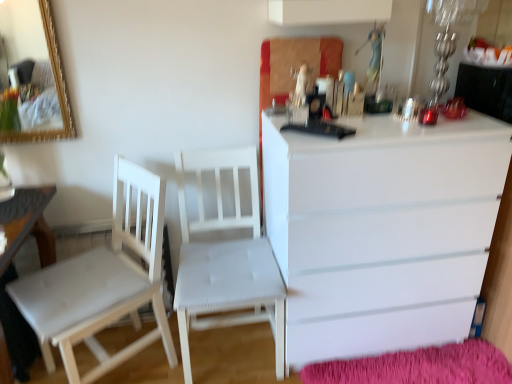
Question: From the image's perspective, is white wood table at lower left on white wood chair at center, which is the 2th chair in right-to-left order?

Choices:
 (A) yes
 (B) no

Answer: (B)

Question: Is white wood table at lower left located outside white wood chair at center, arranged as the first chair when viewed from the left?

Choices:
 (A) no
 (B) yes

Answer: (B)

Question: Are white wood table at lower left and white wood chair at center, arranged as the first chair when viewed from the left, far apart?

Choices:
 (A) yes
 (B) no

Answer: (B)

Question: Is white wood table at lower left oriented towards white wood chair at center, which is the 2th chair in right-to-left order?

Choices:
 (A) no
 (B) yes

Answer: (A)

Question: From the image's perspective, is white wood table at lower left located beneath white wood chair at center, which is the 2th chair in right-to-left order?

Choices:
 (A) no
 (B) yes

Answer: (B)

Question: Considering the positions of white wood chair at center, which is the 2th chair in right-to-left order, and fuzzy pink mat at lower right in the image, is white wood chair at center, which is the 2th chair in right-to-left order, bigger or smaller than fuzzy pink mat at lower right?

Choices:
 (A) small
 (B) big

Answer: (B)

Question: Is white wood chair at center, which is the 2th chair in right-to-left order, in front of or behind fuzzy pink mat at lower right in the image?

Choices:
 (A) behind
 (B) front

Answer: (B)

Question: Is white wood chair at center, arranged as the first chair when viewed from the left, situated inside fuzzy pink mat at lower right or outside?

Choices:
 (A) outside
 (B) inside

Answer: (A)

Question: In terms of height, does white wood chair at center, which is the 2th chair in right-to-left order, look taller or shorter compared to fuzzy pink mat at lower right?

Choices:
 (A) tall
 (B) short

Answer: (A)

Question: From the image's perspective, is white glossy chest of drawers at right above or below white wood chair at center, arranged as the first chair when viewed from the left?

Choices:
 (A) above
 (B) below

Answer: (A)

Question: From a real-world perspective, is white glossy chest of drawers at right physically located above or below white wood chair at center, which is the 2th chair in right-to-left order?

Choices:
 (A) above
 (B) below

Answer: (A)

Question: In terms of size, does white glossy chest of drawers at right appear bigger or smaller than white wood chair at center, arranged as the first chair when viewed from the left?

Choices:
 (A) big
 (B) small

Answer: (A)

Question: In terms of width, does white glossy chest of drawers at right look wider or thinner when compared to white wood chair at center, arranged as the first chair when viewed from the left?

Choices:
 (A) wide
 (B) thin

Answer: (A)

Question: Looking at the image, does fuzzy pink mat at lower right seem bigger or smaller compared to white glossy chest of drawers at right?

Choices:
 (A) small
 (B) big

Answer: (A)

Question: In terms of width, does fuzzy pink mat at lower right look wider or thinner when compared to white glossy chest of drawers at right?

Choices:
 (A) wide
 (B) thin

Answer: (B)